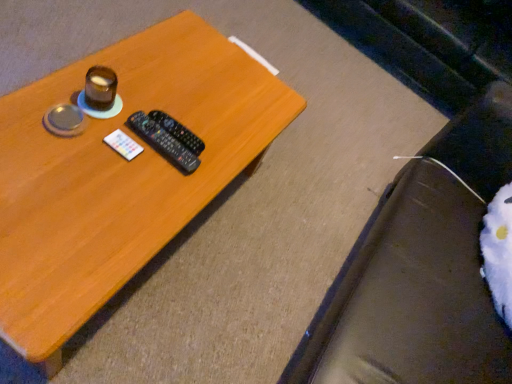
Where is `vacant space to the right of shiny brown cup at upper left`? vacant space to the right of shiny brown cup at upper left is located at coordinates [x=148, y=137].